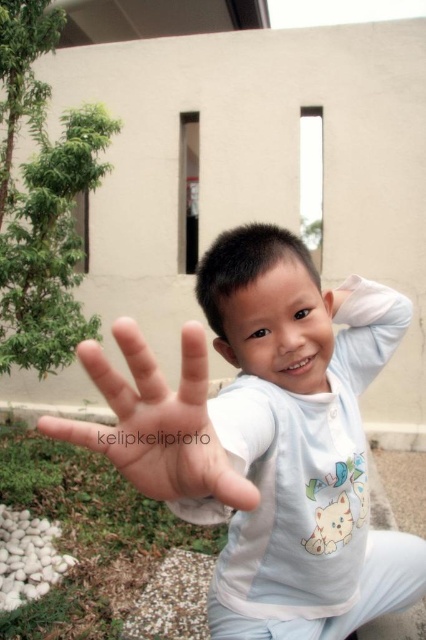
Between white cotton shirt at center and smooth skin hand at center, which one is positioned lower?

white cotton shirt at center is lower down.

Is white cotton shirt at center bigger than smooth skin hand at center?

Yes, white cotton shirt at center is bigger than smooth skin hand at center.

Locate an element on the screen. The height and width of the screenshot is (640, 426). white cotton shirt at center is located at coordinates (299, 442).

In order to click on white cotton shirt at center in this screenshot , I will do click(299, 442).